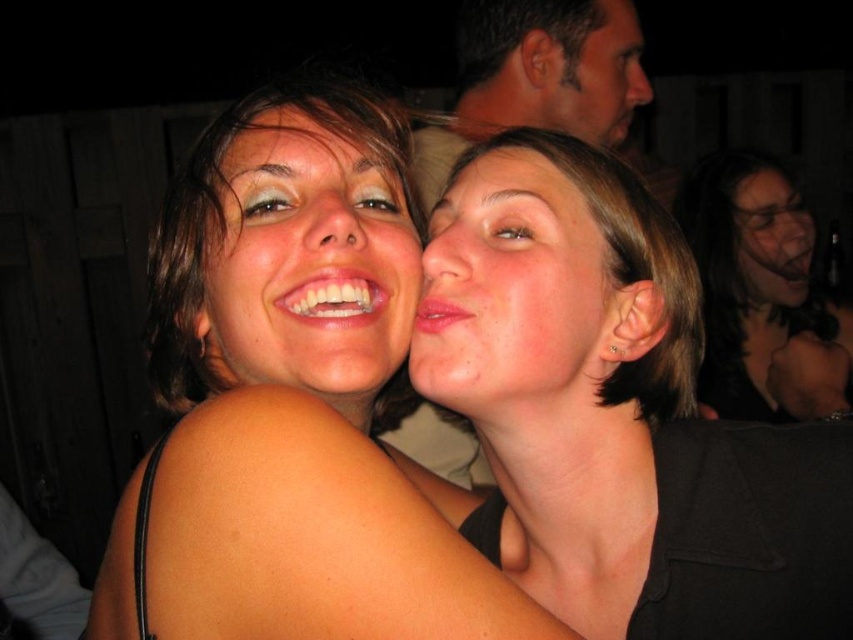
This screenshot has height=640, width=853. Describe the element at coordinates (595, 77) in the screenshot. I see `matte skin face at upper center` at that location.

Who is lower down, matte skin face at upper center or matte skin face at upper right?

matte skin face at upper right

Image resolution: width=853 pixels, height=640 pixels. What do you see at coordinates (595, 77) in the screenshot? I see `matte skin face at upper center` at bounding box center [595, 77].

Where is `matte skin face at upper center`? matte skin face at upper center is located at coordinates (595, 77).

Does smooth skin face at center appear over matte skin face at upper center?

No.

Can you confirm if smooth skin face at center is smaller than matte skin face at upper center?

Yes.

What do you see at coordinates (511, 288) in the screenshot? I see `smooth skin face at center` at bounding box center [511, 288].

Where is `smooth skin face at center`? smooth skin face at center is located at coordinates (511, 288).

Which is more to the left, matte skin at center or smooth skin face at center?

matte skin at center

Does matte skin at center lie behind smooth skin face at center?

No, matte skin at center is closer to the viewer.

Find the location of `matte skin at center`. matte skin at center is located at coordinates (293, 401).

You are a GUI agent. You are given a task and a screenshot of the screen. Output one action in this format:
    pyautogui.click(x=<x>, y=<y>)
    Task: Click on the matte skin at center
    The height and width of the screenshot is (640, 853).
    Given the screenshot: What is the action you would take?
    pyautogui.click(x=293, y=401)